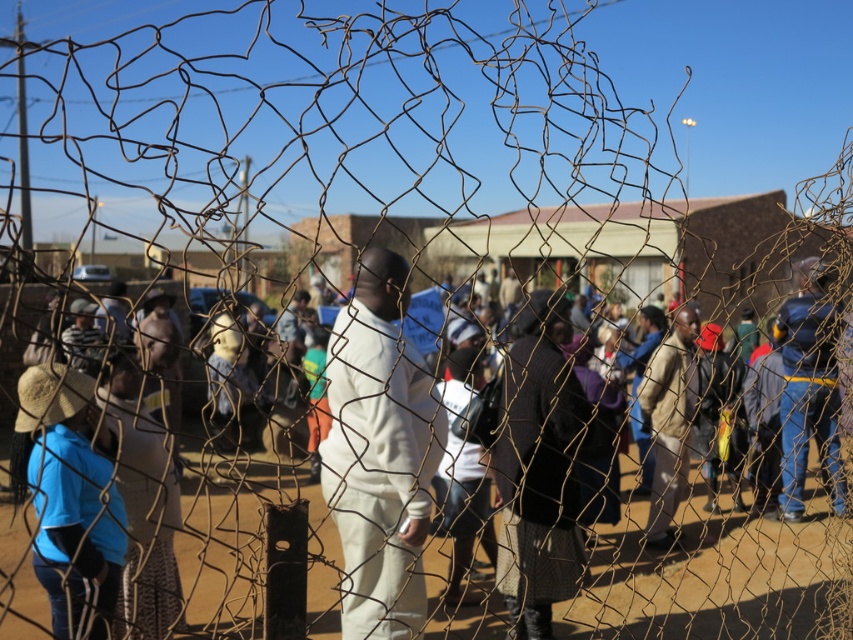
Does point (583, 412) come behind point (397, 282)?

No, it is in front of (397, 282).

Which is more to the left, wire mesh fence at center or white matte pants at center?

Positioned to the left is white matte pants at center.

Between point (323, 506) and point (384, 308), which one is positioned in front?

Point (384, 308) is in front.

This screenshot has height=640, width=853. I want to click on wire mesh fence at center, so [x=390, y=506].

Can you confirm if dark brown textured coat at center is positioned above blue denim jeans at right?

Actually, dark brown textured coat at center is below blue denim jeans at right.

Between point (515, 312) and point (786, 508), which one is positioned behind?

The point (786, 508) is behind.

Measure the distance between point (544,435) and camera.

Point (544,435) is 4.55 meters away from camera.

Locate an element on the screen. The height and width of the screenshot is (640, 853). dark brown textured coat at center is located at coordinates (538, 467).

Can you confirm if blue denim jeans at right is bigger than light brown leather jacket at center?

Indeed, blue denim jeans at right has a larger size compared to light brown leather jacket at center.

Can you confirm if blue denim jeans at right is taller than light brown leather jacket at center?

Correct, blue denim jeans at right is much taller as light brown leather jacket at center.

Which is in front, point (834, 417) or point (683, 326)?

Point (834, 417) is more forward.

Image resolution: width=853 pixels, height=640 pixels. I want to click on blue denim jeans at right, so click(x=808, y=387).